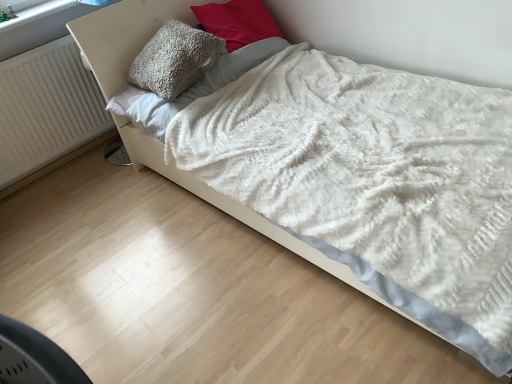
I want to click on vacant region below white ribbed radiator at left (from a real-world perspective), so click(55, 172).